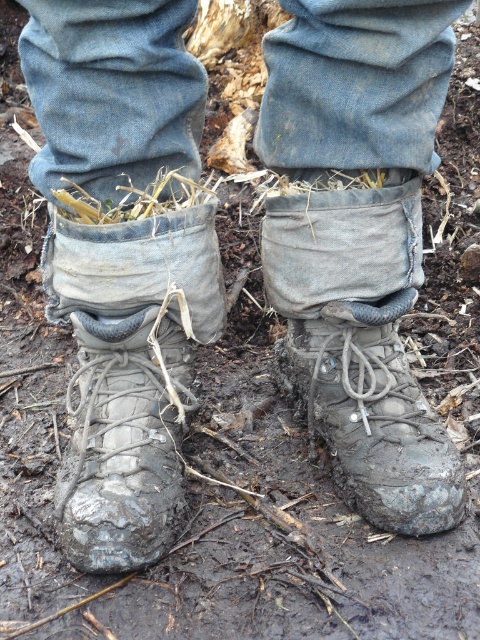
Can you confirm if muddy rubber boot at lower left is positioned below muddy rubber boot at center?

Yes.

Does point (73, 285) come behind point (398, 349)?

No, it is in front of (398, 349).

You are a GUI agent. You are given a task and a screenshot of the screen. Output one action in this format:
    pyautogui.click(x=<x>, y=<y>)
    Task: Click on the muddy rubber boot at lower left
    The width and height of the screenshot is (480, 640).
    Given the screenshot: What is the action you would take?
    pyautogui.click(x=130, y=376)

Between denim at center and muddy rubber boot at center, which one has less height?

denim at center

Is point (310, 108) more distant than point (350, 394)?

No, it is in front of (350, 394).

The width and height of the screenshot is (480, 640). I want to click on denim at center, so tap(111, 90).

What do you see at coordinates (111, 90) in the screenshot? Image resolution: width=480 pixels, height=640 pixels. I see `denim at center` at bounding box center [111, 90].

Which is below, denim at center or brown straw at center?

brown straw at center

Which is in front, point (165, 152) or point (377, 179)?

Point (165, 152) is more forward.

At what (x,y) coordinates should I click in order to perform the action: click on denim at center. Please return your answer as a coordinate pair (x, y). Looking at the image, I should click on (111, 90).